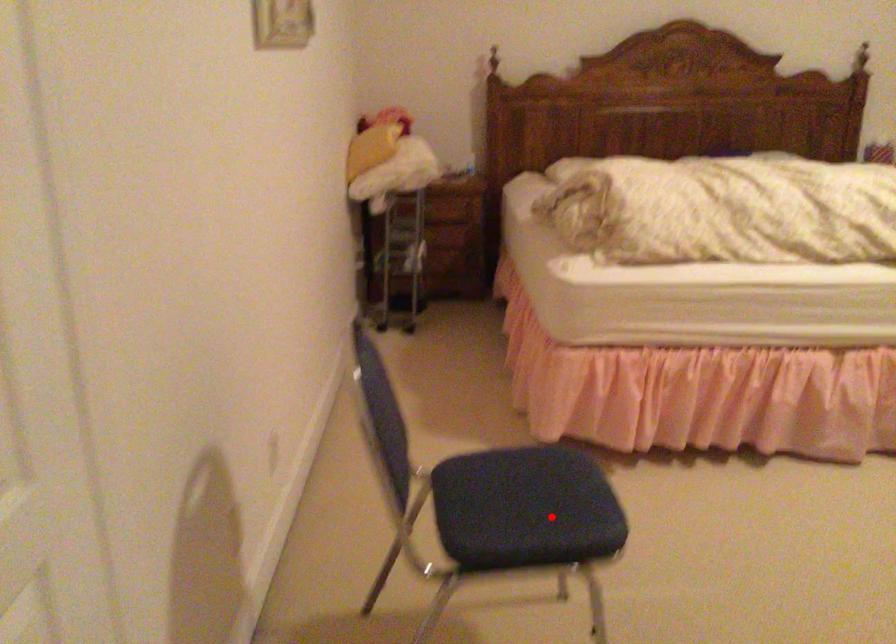
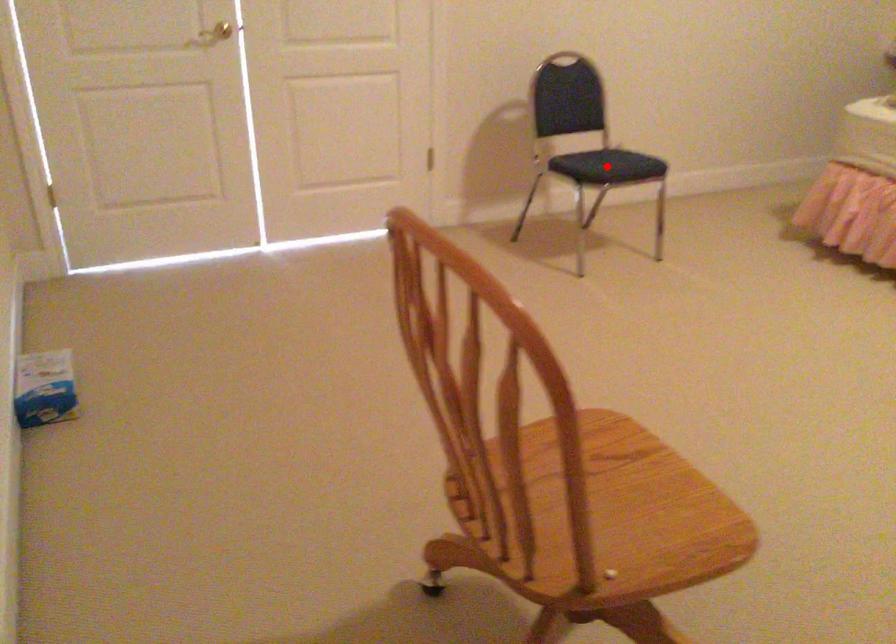
I am providing you with two images of the same scene from different viewpoints. A red point is marked on the first image and another point is marked on the second image. Are the points marked in image1 and image2 representing the same 3D position?

Yes